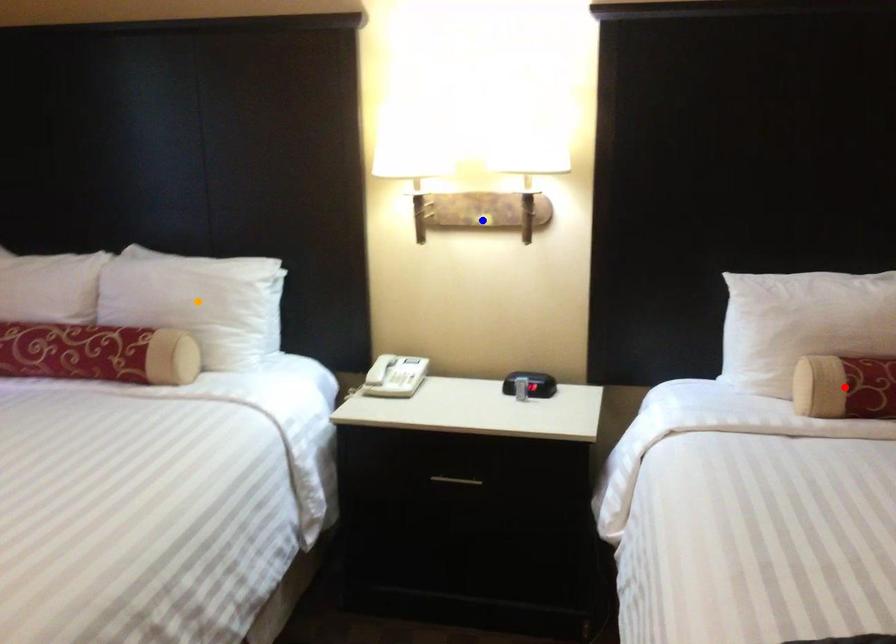
Order these from nearest to farthest:
orange point | red point | blue point

red point
orange point
blue point